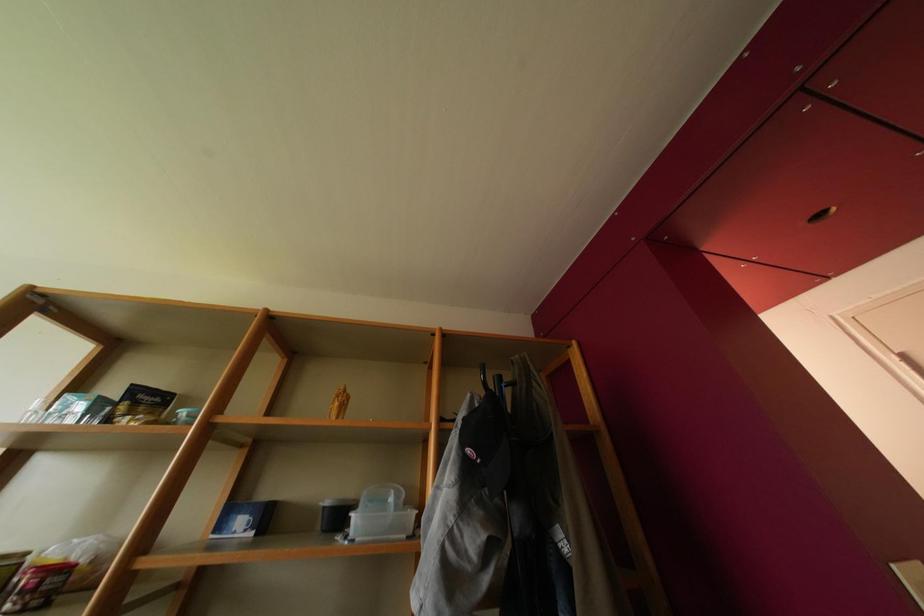
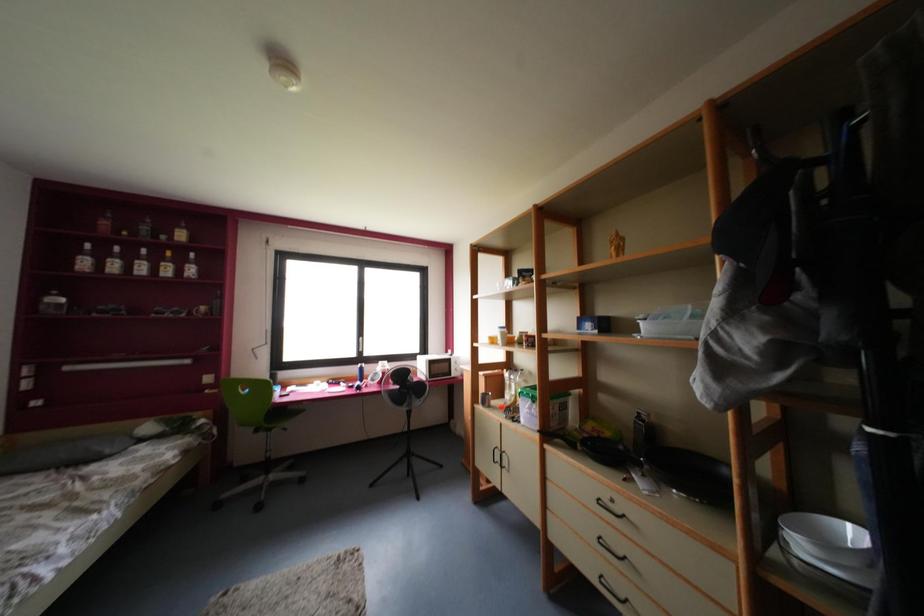
Question: The first image is from the beginning of the video and the second image is from the end. How did the camera likely rotate when shooting the video?

Choices:
 (A) Left
 (B) Right
 (C) Up
 (D) Down

Answer: (A)